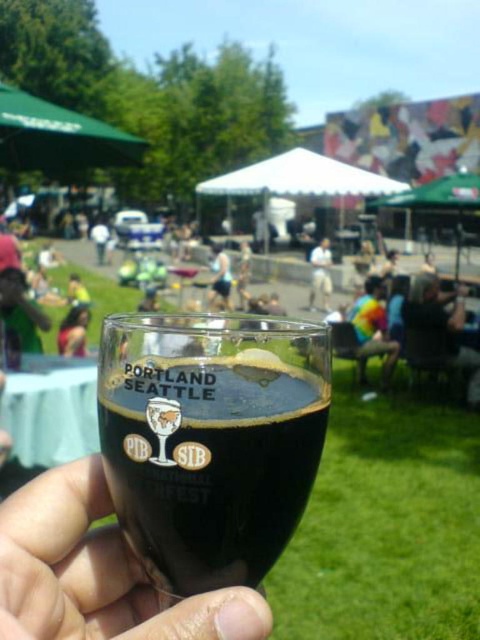
Question: In this image, where is transparent plastic glass at center located relative to white cotton shirt at center?

Choices:
 (A) below
 (B) above

Answer: (A)

Question: Among these points, which one is farthest from the camera?

Choices:
 (A) (323, 301)
 (B) (68, 637)
 (C) (168, 520)

Answer: (A)

Question: Among these points, which one is nearest to the camera?

Choices:
 (A) (119, 330)
 (B) (326, 260)

Answer: (A)

Question: From the image, what is the correct spatial relationship of transparent glass at center in relation to white cotton shirt at center?

Choices:
 (A) left
 (B) right

Answer: (A)

Question: Can you confirm if transparent plastic glass at center is positioned to the right of white cotton shirt at center?

Choices:
 (A) yes
 (B) no

Answer: (B)

Question: Which object appears closest to the camera in this image?

Choices:
 (A) white cotton shirt at center
 (B) transparent glass at center

Answer: (B)